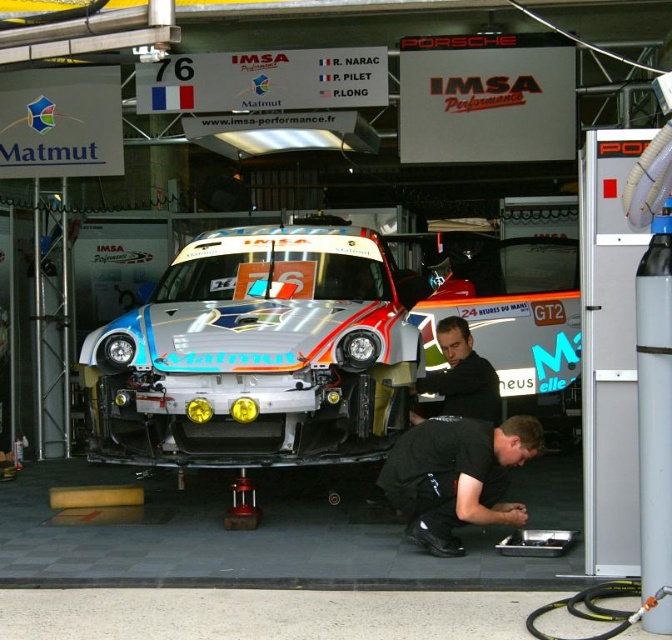
You are a technician in the garage and need to place a tool box between the silver metallic car at center and the black fabric squat at lower center. Considering their sizes, which object will require more space for the tool box placement?

The silver metallic car at center has a larger size compared to black fabric squat at lower center, so placing the tool box next to the silver metallic car at center will require more space due to its larger dimensions.

You are a mechanic working in the garage and need to place a tool box on the floor. The tool box requires a clear space of 0.5 meters in front of it. Is there enough space in front of the black fabric squat at lower center to place the tool box?

The position of black fabric squat at lower center is at point (456, 476). Since the exact dimensions and available space in front of it aren not provided, it is impossible to determine if there is enough space to place the tool box.